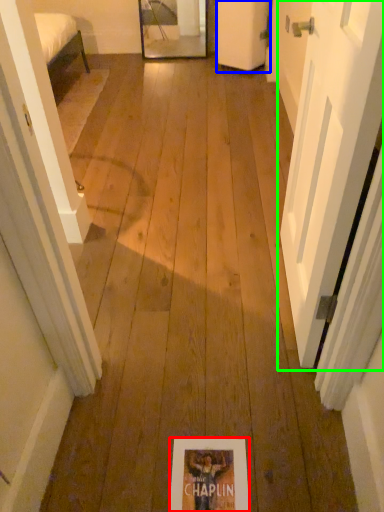
Question: Which is nearer to the flyer (highlighted by a red box)? door (highlighted by a blue box) or door (highlighted by a green box).

Choices:
 (A) door
 (B) door

Answer: (B)